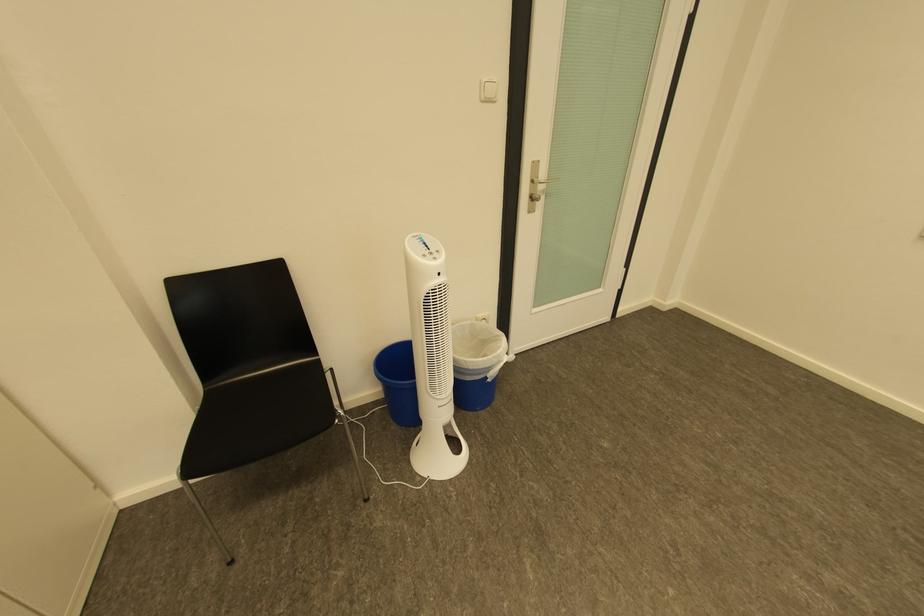
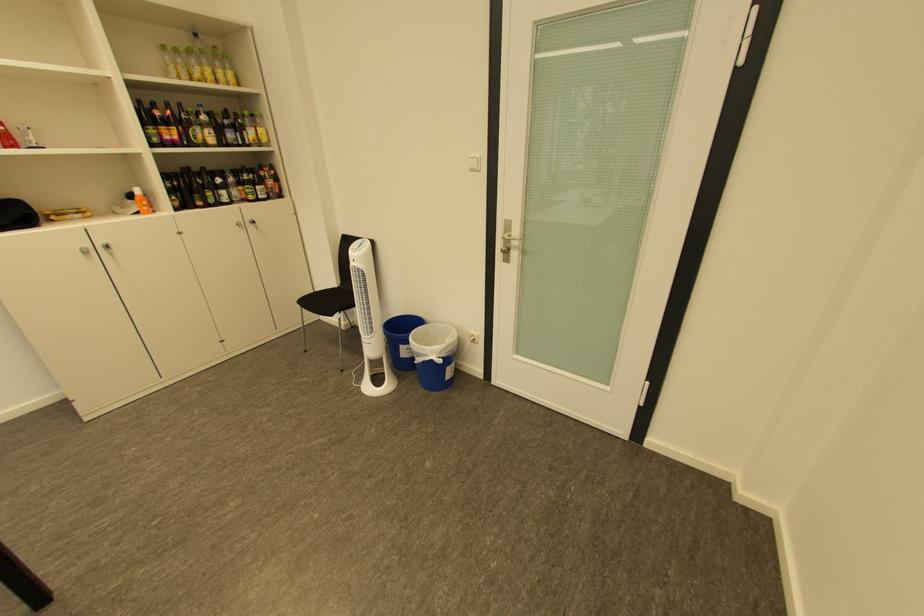
In the second image, find the point that corresponds to (x=499, y=370) in the first image.

(429, 355)